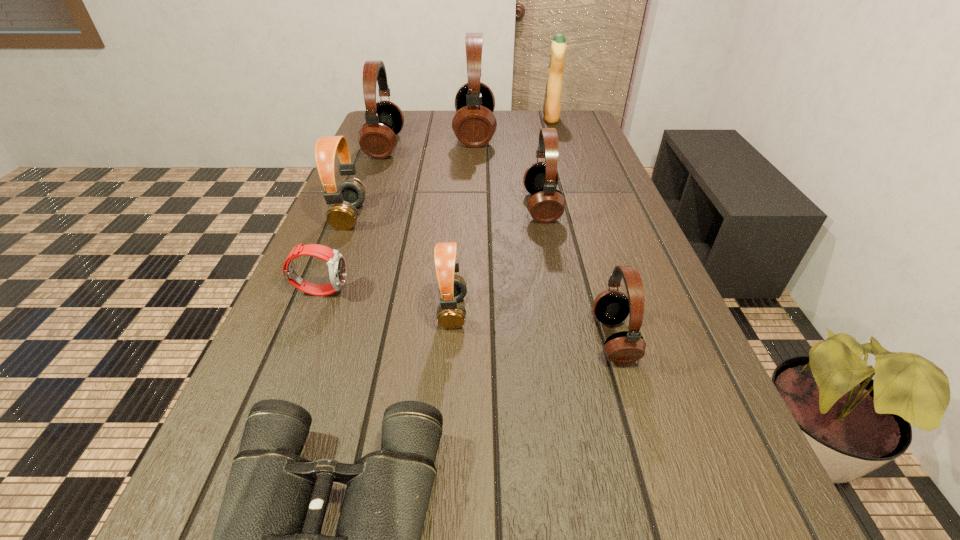
The image size is (960, 540). In order to click on the third black headset from right to left in this screenshot , I will do `click(474, 124)`.

Identify the location of the tallest headset. (474, 124).

The width and height of the screenshot is (960, 540). I want to click on detergent, so click(x=552, y=100).

Where is `the third smallest black headset`? This screenshot has width=960, height=540. the third smallest black headset is located at coordinates (377, 138).

This screenshot has width=960, height=540. I want to click on the leftmost black headset, so click(x=377, y=138).

This screenshot has height=540, width=960. Find the location of `the left brown headset`. the left brown headset is located at coordinates (342, 214).

Identify the location of the farther brown headset. This screenshot has height=540, width=960. (342, 214).

This screenshot has width=960, height=540. Identify the location of the third farthest black headset. (546, 204).

Where is `the third black headset from left to right`? The image size is (960, 540). the third black headset from left to right is located at coordinates (546, 204).

Where is `the nearer brown headset`? the nearer brown headset is located at coordinates (452, 288).